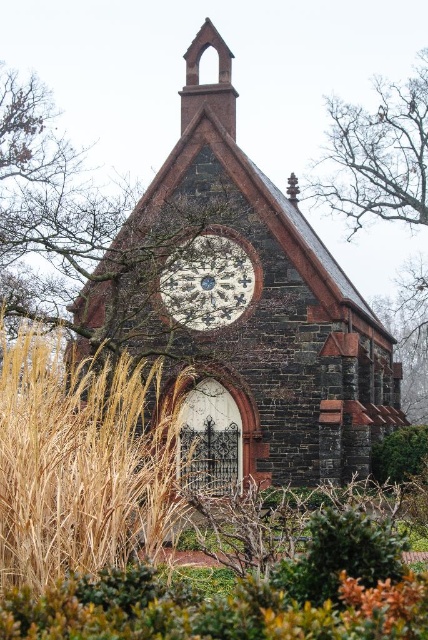
You are standing in front of the quaint stone chapel. You want to take a photo of the white stone clock at center. Considering the distance, do you think you need to use the zoom feature on your camera?

The white stone clock at center is 77.34 meters away from camera. Since this distance is quite far, you should use the zoom feature on your camera to capture a clear image of the clock.